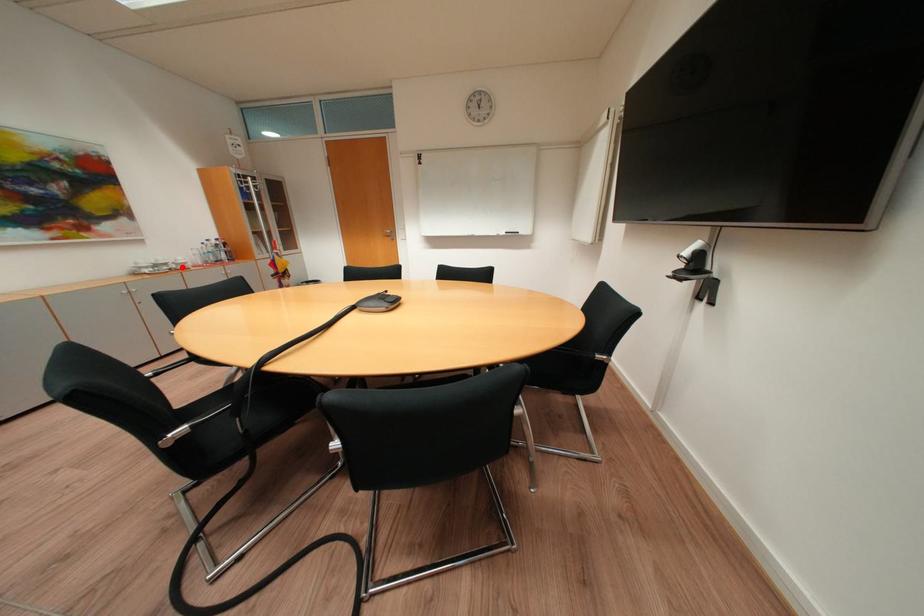
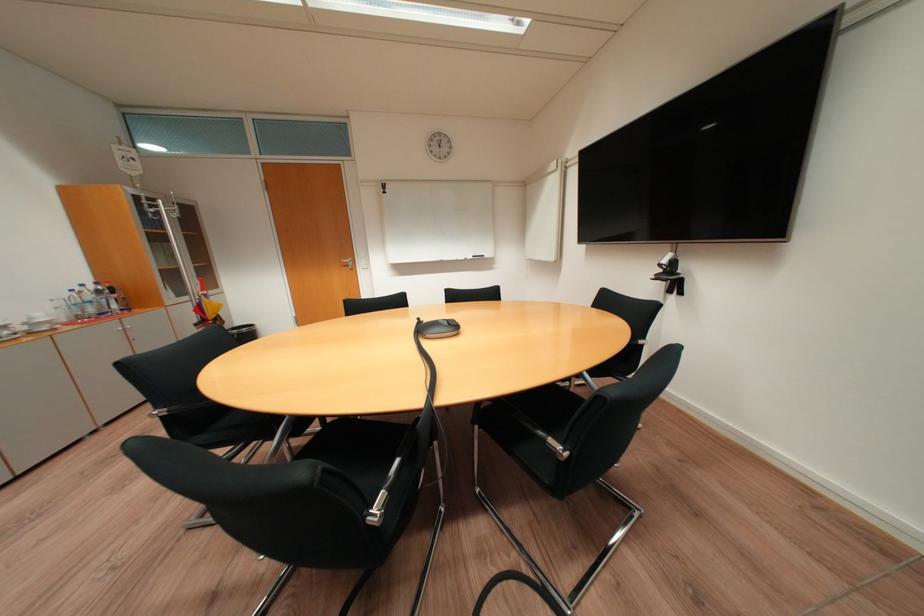
Question: I am providing you with two images of the same scene from different viewpoints. A red point is marked on the first image. Can you still see the location of the red point in image 2?

Choices:
 (A) Yes
 (B) No

Answer: (A)